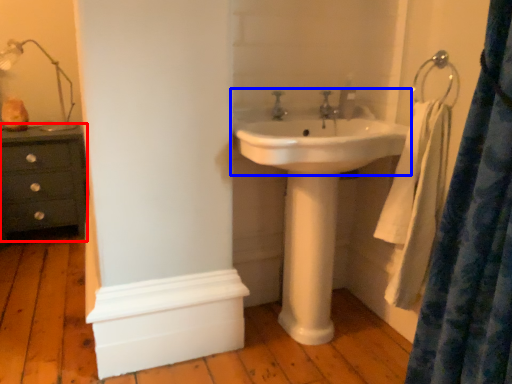
Question: Which of the following is the farthest to the observer, chest of drawers (highlighted by a red box) or sink (highlighted by a blue box)?

Choices:
 (A) chest of drawers
 (B) sink

Answer: (A)